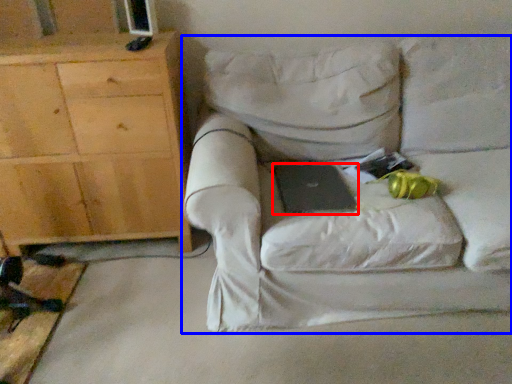
Question: Among these objects, which one is farthest to the camera, laptop (highlighted by a red box) or chair (highlighted by a blue box)?

Choices:
 (A) laptop
 (B) chair

Answer: (A)